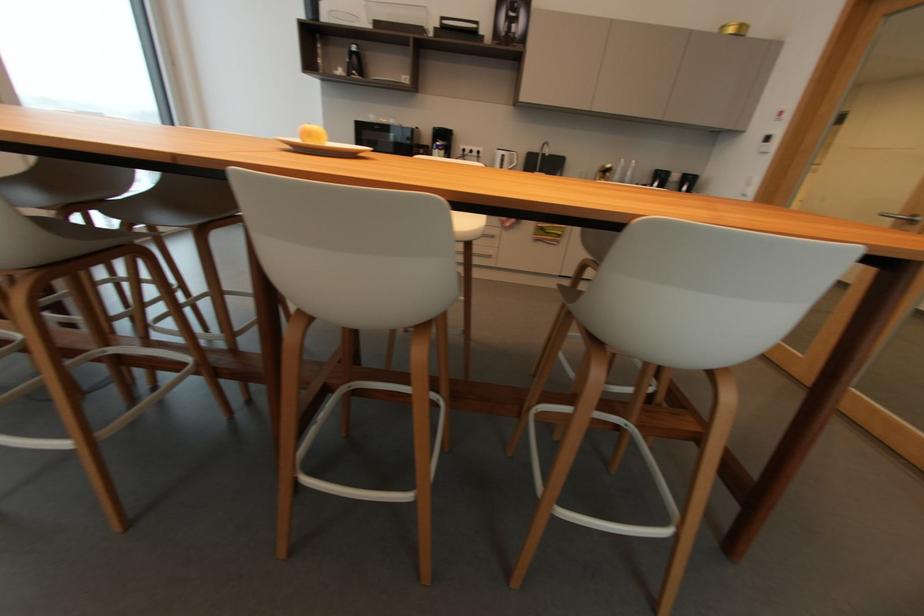
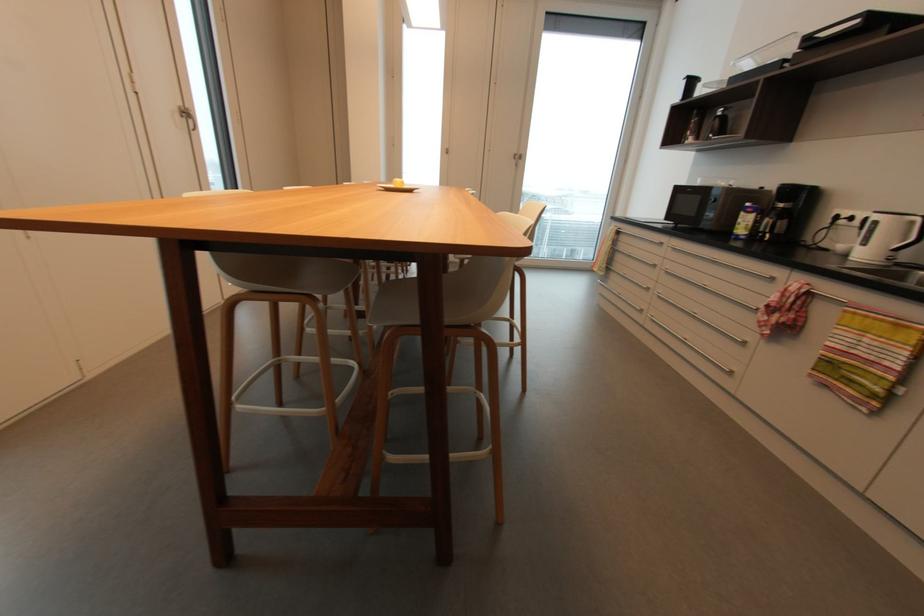
The point at [516,156] is marked in the first image. Where is the corresponding point in the second image?

(916, 223)